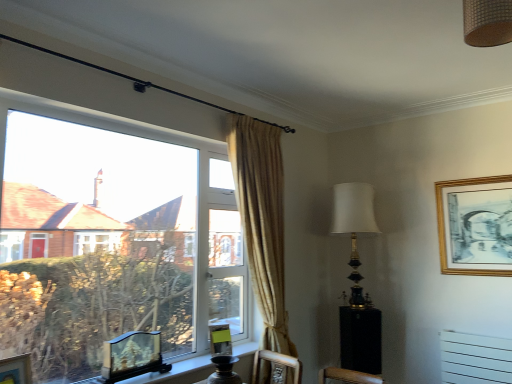
Question: Is black glossy side table at lower right outside of gold/gilded picture frame at upper right, which appears as the fourth picture frame when viewed from the front?

Choices:
 (A) no
 (B) yes

Answer: (B)

Question: Is gold/gilded picture frame at upper right, which appears as the fourth picture frame when viewed from the front, at the back of black glossy side table at lower right?

Choices:
 (A) yes
 (B) no

Answer: (B)

Question: From a real-world perspective, is black glossy side table at lower right physically above gold/gilded picture frame at upper right, placed as the first picture frame when sorted from top to bottom?

Choices:
 (A) yes
 (B) no

Answer: (B)

Question: Does black glossy side table at lower right appear on the left side of gold/gilded picture frame at upper right, placed as the first picture frame when sorted from top to bottom?

Choices:
 (A) no
 (B) yes

Answer: (B)

Question: Are black glossy side table at lower right and gold/gilded picture frame at upper right, the 1th picture frame when ordered from right to left, making contact?

Choices:
 (A) yes
 (B) no

Answer: (B)

Question: Based on their sizes in the image, would you say black glossy side table at lower right is bigger or smaller than wooden carved picture frame at window, which is counted as the third picture frame, starting from the right?

Choices:
 (A) big
 (B) small

Answer: (A)

Question: In terms of height, does black glossy side table at lower right look taller or shorter compared to wooden carved picture frame at window, which is counted as the 2th picture frame, starting from the front?

Choices:
 (A) tall
 (B) short

Answer: (A)

Question: Is black glossy side table at lower right inside the boundaries of wooden carved picture frame at window, the 2th picture frame from the bottom, or outside?

Choices:
 (A) outside
 (B) inside

Answer: (A)

Question: Does point (353, 329) appear closer or farther from the camera than point (154, 331)?

Choices:
 (A) closer
 (B) farther

Answer: (B)

Question: From a real-world perspective, is gold/gilded picture frame at upper right, which is counted as the fourth picture frame, starting from the left, positioned above or below black glossy side table at lower right?

Choices:
 (A) above
 (B) below

Answer: (A)

Question: Do you think gold/gilded picture frame at upper right, placed as the first picture frame when sorted from top to bottom, is within black glossy side table at lower right, or outside of it?

Choices:
 (A) inside
 (B) outside

Answer: (B)

Question: From the image's perspective, relative to black glossy side table at lower right, is gold/gilded picture frame at upper right, which is counted as the fourth picture frame, starting from the left, above or below?

Choices:
 (A) below
 (B) above

Answer: (B)

Question: Is point (486, 190) closer or farther from the camera than point (373, 355)?

Choices:
 (A) farther
 (B) closer

Answer: (B)

Question: Is wooden carved picture frame at window, which is counted as the third picture frame, starting from the right, taller or shorter than matte green picture frame at lower center, marked as the 2th picture frame in a right-to-left arrangement?

Choices:
 (A) short
 (B) tall

Answer: (B)

Question: Considering the positions of point (147, 370) and point (221, 337), is point (147, 370) closer or farther from the camera than point (221, 337)?

Choices:
 (A) closer
 (B) farther

Answer: (A)